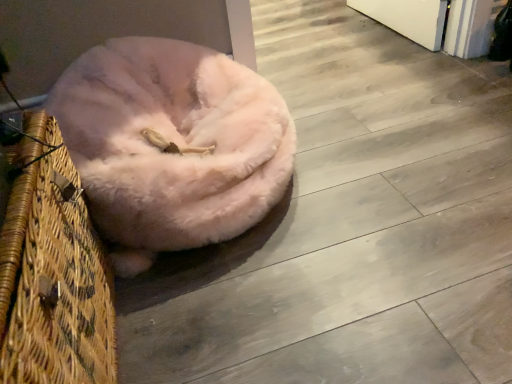
Question: Is fuzzy pink dog bed at center turned away from woven straw basket at left?

Choices:
 (A) no
 (B) yes

Answer: (A)

Question: Is woven straw basket at left surrounded by fuzzy pink dog bed at center?

Choices:
 (A) yes
 (B) no

Answer: (B)

Question: Could you tell me if fuzzy pink dog bed at center is turned towards woven straw basket at left?

Choices:
 (A) no
 (B) yes

Answer: (B)

Question: Considering the relative positions of fuzzy pink dog bed at center and woven straw basket at left in the image provided, is fuzzy pink dog bed at center to the right of woven straw basket at left from the viewer's perspective?

Choices:
 (A) yes
 (B) no

Answer: (A)

Question: Can you confirm if fuzzy pink dog bed at center is thinner than woven straw basket at left?

Choices:
 (A) yes
 (B) no

Answer: (B)

Question: Is fuzzy pink dog bed at center positioned far away from woven straw basket at left?

Choices:
 (A) yes
 (B) no

Answer: (B)

Question: Considering the relative positions of woven straw basket at left and fuzzy pink dog bed at center in the image provided, is woven straw basket at left to the left of fuzzy pink dog bed at center from the viewer's perspective?

Choices:
 (A) no
 (B) yes

Answer: (B)

Question: Is woven straw basket at left in front of fuzzy pink dog bed at center?

Choices:
 (A) yes
 (B) no

Answer: (A)

Question: Is woven straw basket at left outside fuzzy pink dog bed at center?

Choices:
 (A) yes
 (B) no

Answer: (A)

Question: From the image's perspective, would you say woven straw basket at left is positioned over fuzzy pink dog bed at center?

Choices:
 (A) yes
 (B) no

Answer: (B)

Question: Does woven straw basket at left have a greater width compared to fuzzy pink dog bed at center?

Choices:
 (A) yes
 (B) no

Answer: (B)

Question: Does woven straw basket at left come behind fuzzy pink dog bed at center?

Choices:
 (A) yes
 (B) no

Answer: (B)

Question: Considering the positions of woven straw basket at left and fuzzy pink dog bed at center in the image, is woven straw basket at left taller or shorter than fuzzy pink dog bed at center?

Choices:
 (A) short
 (B) tall

Answer: (B)